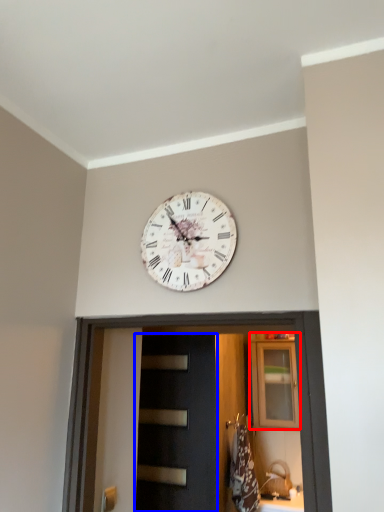
Question: Which point is closer to the camera, cabinetry (highlighted by a red box) or door (highlighted by a blue box)?

Choices:
 (A) cabinetry
 (B) door

Answer: (B)